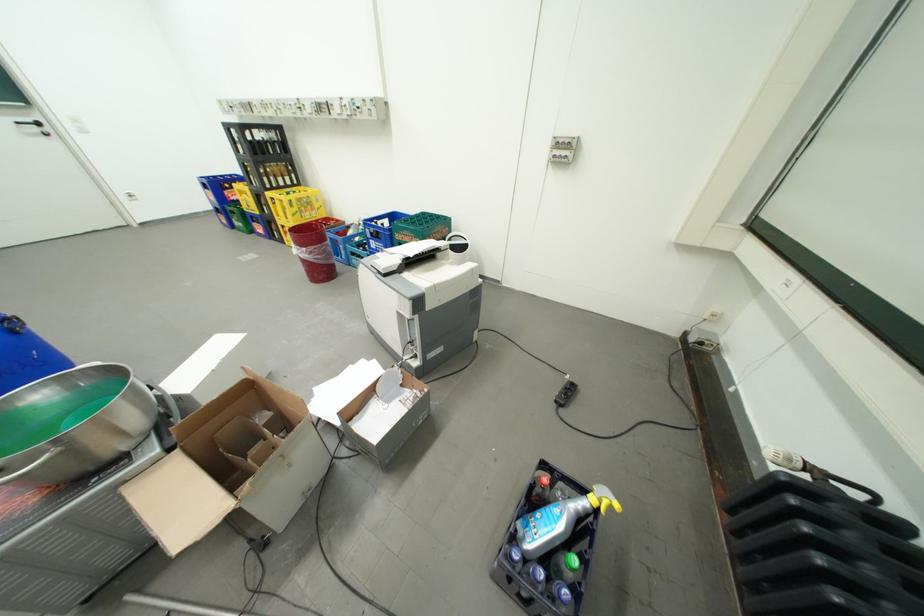
Locate an element on the screen. This screenshot has width=924, height=616. yellow spray nozzle is located at coordinates (604, 499).